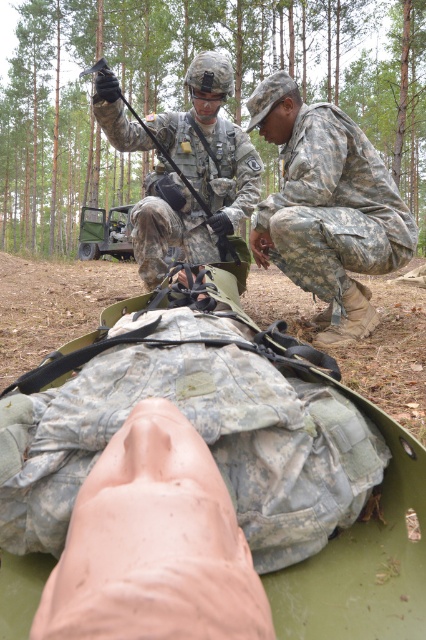
Question: Considering the real-world distances, which object is farthest from the camouflage uniform at upper center?

Choices:
 (A) camouflage fabric vehicle at center
 (B) camouflage fabric uniform at lower right

Answer: (A)

Question: Can you confirm if camouflage uniform at upper center is bigger than camouflage fabric vehicle at center?

Choices:
 (A) no
 (B) yes

Answer: (B)

Question: Which of the following is the closest to the observer?

Choices:
 (A) (333, 147)
 (B) (201, 156)

Answer: (A)

Question: Observing the image, what is the correct spatial positioning of camouflage fabric uniform at lower right in reference to camouflage uniform at upper center?

Choices:
 (A) below
 (B) above

Answer: (A)

Question: Which point is farther from the camera taking this photo?

Choices:
 (A) (169, 225)
 (B) (89, 230)

Answer: (B)

Question: Can you confirm if camouflage fabric uniform at lower right is positioned below camouflage fabric vehicle at center?

Choices:
 (A) yes
 (B) no

Answer: (A)